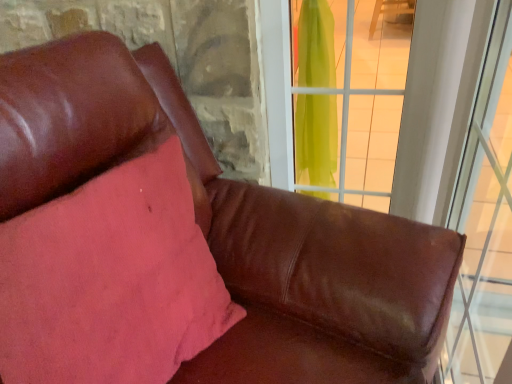
Question: Should I look upward or downward to see pink fabric pillow at upper left?

Choices:
 (A) up
 (B) down

Answer: (B)

Question: Does transparent green curtain at upper right, the first window in the left-to-right sequence, appear on the left side of transparent glass window at right, the 1th window positioned from the right?

Choices:
 (A) yes
 (B) no

Answer: (A)

Question: Is transparent green curtain at upper right, the first window in the left-to-right sequence, positioned in front of transparent glass window at right, the 1th window positioned from the right?

Choices:
 (A) no
 (B) yes

Answer: (A)

Question: Does transparent green curtain at upper right, marked as the 2th window in a right-to-left arrangement, appear on the right side of transparent glass window at right, which ranks as the second window in left-to-right order?

Choices:
 (A) no
 (B) yes

Answer: (A)

Question: Is transparent green curtain at upper right, the first window in the left-to-right sequence, bigger than transparent glass window at right, the 1th window positioned from the right?

Choices:
 (A) no
 (B) yes

Answer: (A)

Question: From a real-world perspective, is transparent green curtain at upper right, marked as the 2th window in a right-to-left arrangement, below transparent glass window at right, which ranks as the second window in left-to-right order?

Choices:
 (A) yes
 (B) no

Answer: (B)

Question: Is transparent green curtain at upper right, marked as the 2th window in a right-to-left arrangement, with transparent glass window at right, the 1th window positioned from the right?

Choices:
 (A) yes
 (B) no

Answer: (B)

Question: Is transparent green curtain at upper right, marked as the 2th window in a right-to-left arrangement, to the right of pink fabric pillow at upper left from the viewer's perspective?

Choices:
 (A) yes
 (B) no

Answer: (A)

Question: Is transparent green curtain at upper right, the first window in the left-to-right sequence, not near pink fabric pillow at upper left?

Choices:
 (A) yes
 (B) no

Answer: (B)

Question: Is transparent green curtain at upper right, marked as the 2th window in a right-to-left arrangement, turned away from pink fabric pillow at upper left?

Choices:
 (A) yes
 (B) no

Answer: (B)

Question: From a real-world perspective, is transparent green curtain at upper right, the first window in the left-to-right sequence, physically below pink fabric pillow at upper left?

Choices:
 (A) no
 (B) yes

Answer: (A)

Question: Is transparent green curtain at upper right, marked as the 2th window in a right-to-left arrangement, wider than pink fabric pillow at upper left?

Choices:
 (A) yes
 (B) no

Answer: (B)

Question: From a real-world perspective, is transparent green curtain at upper right, the first window in the left-to-right sequence, on pink fabric pillow at upper left?

Choices:
 (A) no
 (B) yes

Answer: (B)

Question: Does pink fabric pillow at upper left have a greater width compared to transparent green curtain at upper right, the first window in the left-to-right sequence?

Choices:
 (A) yes
 (B) no

Answer: (A)